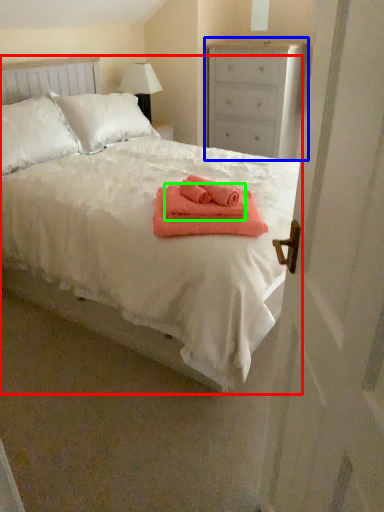
Question: Which is nearer to the bed (highlighted by a red box)? chest of drawers (highlighted by a blue box) or bath towel (highlighted by a green box).

Choices:
 (A) chest of drawers
 (B) bath towel

Answer: (B)